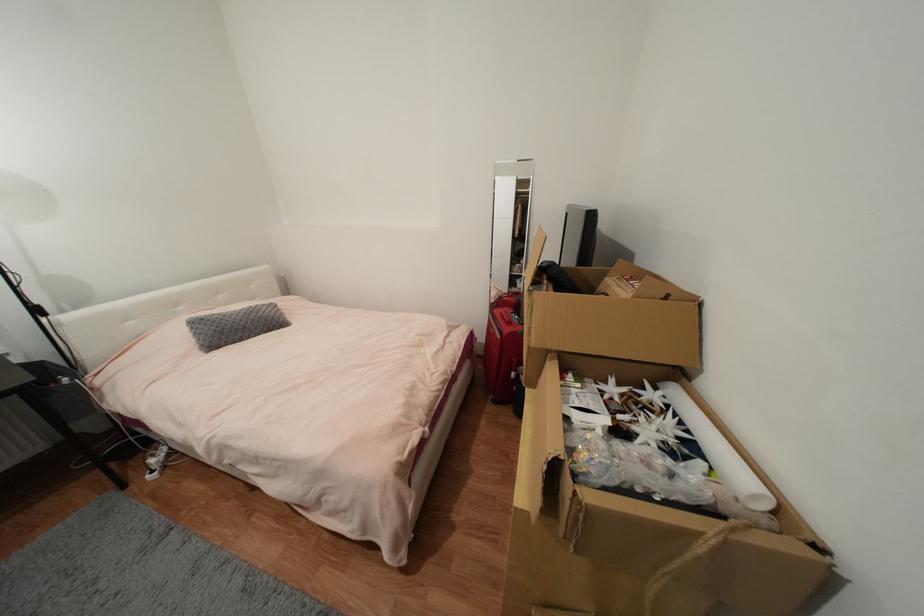
The height and width of the screenshot is (616, 924). Identify the location of white star decoration. (641, 413).